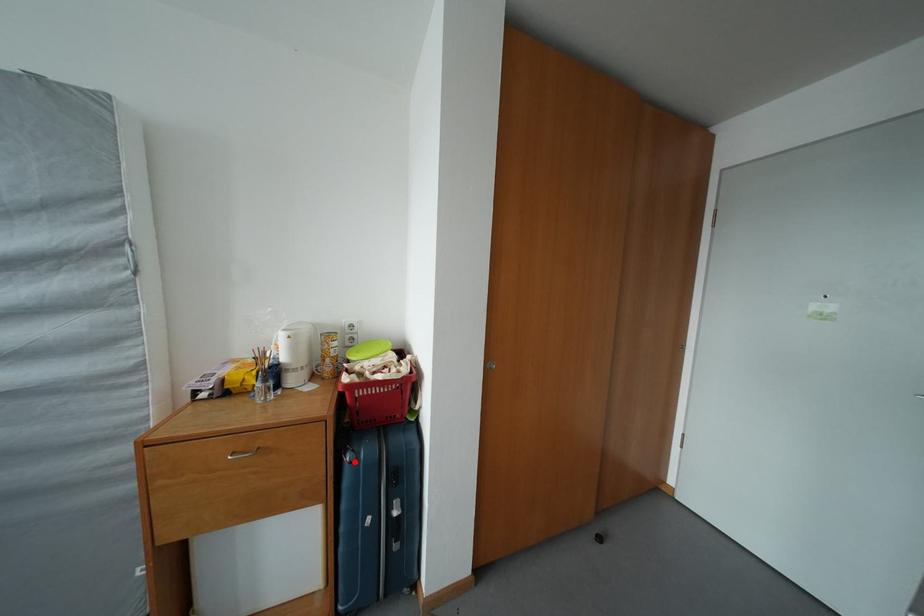
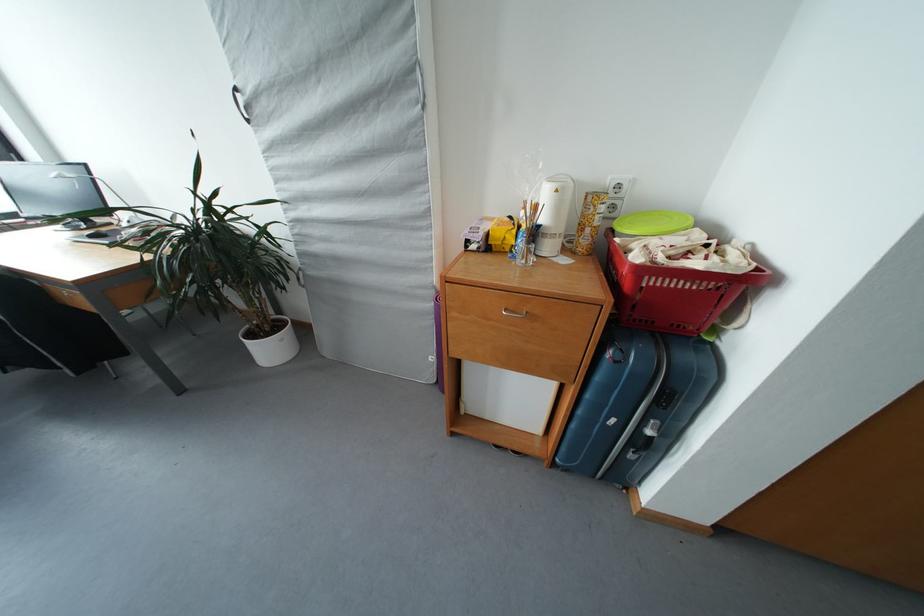
The point at the highlighted location is marked in the first image. Where is the corresponding point in the second image?

(616, 359)